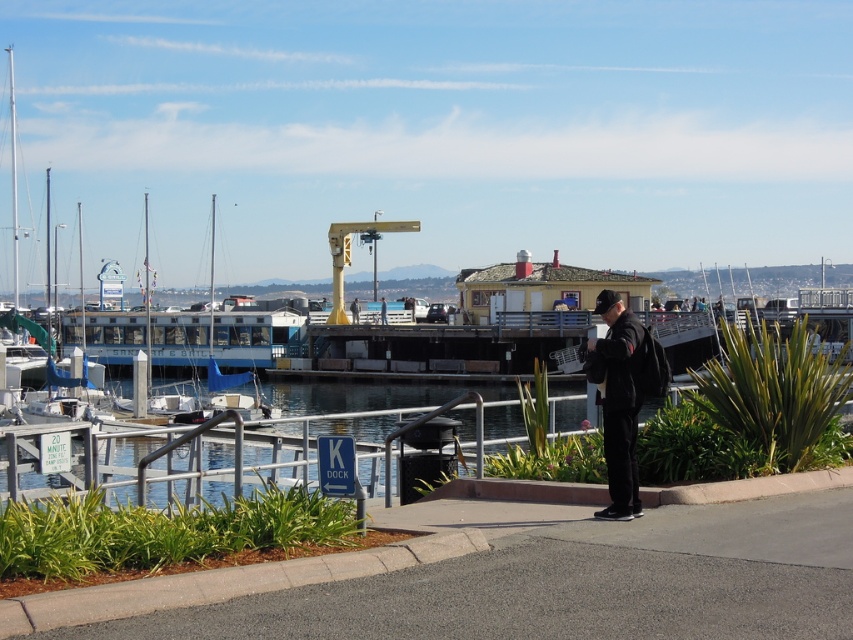
You are standing on the blue painted wooden dock at center and want to place the black matte jacket at center on the dock. Considering the height difference between the two, will the jacket be visible from the water level?

The blue painted wooden dock at center is taller than the black matte jacket at center, so the jacket may not be fully visible from the water level since the dock itself is elevated higher than the jacket.